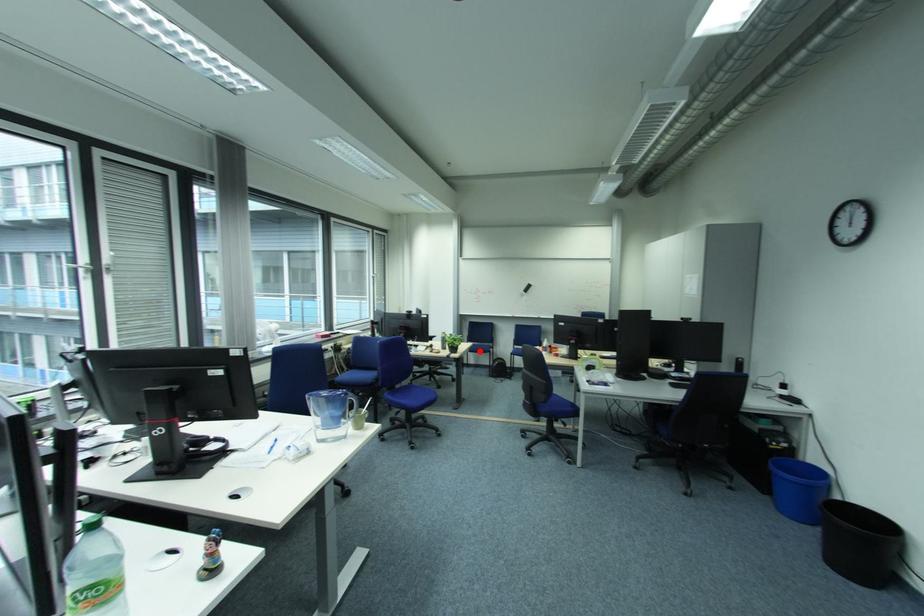
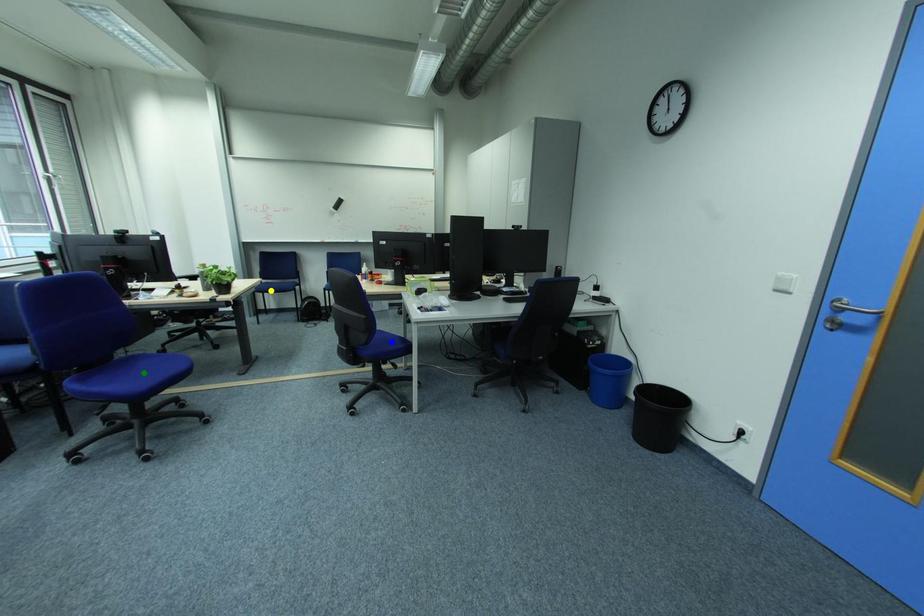
Question: I am providing you with two images of the same scene from different viewpoints. A red point is marked on the first image. You are given multiple points on the second image. Which spot in image 2 lines up with the point in image 1?

Choices:
 (A) yellow point
 (B) blue point
 (C) green point

Answer: (A)